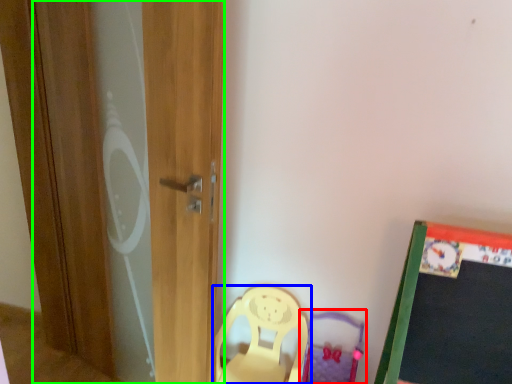
Question: Which is farther away from swivel chair (highlighted by a red box)? chair (highlighted by a blue box) or screen door (highlighted by a green box)?

Choices:
 (A) chair
 (B) screen door

Answer: (B)